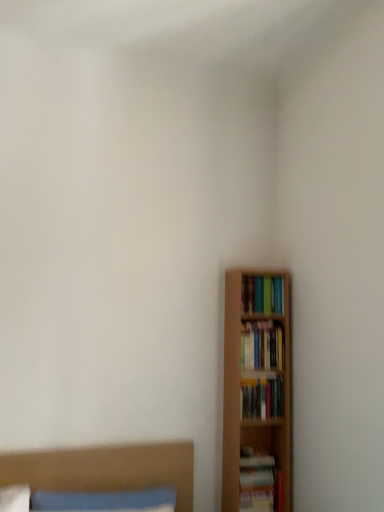
Question: From the image's perspective, relative to hardcover book at lower right, arranged as the first book when ordered from the bottom, is wooden bed at lower left above or below?

Choices:
 (A) above
 (B) below

Answer: (A)

Question: From a real-world perspective, relative to hardcover book at lower right, the 4th book from the top, is wooden bed at lower left vertically above or below?

Choices:
 (A) below
 (B) above

Answer: (B)

Question: Estimate the real-world distances between objects in this image. Which object is closer to the hardcover books at right, which is the 2th book in top-to-bottom order?

Choices:
 (A) hardcover book at lower right, the 4th book from the top
 (B) wooden bed at lower left
 (C) matte green book at right, the fourth book when ordered from bottom to top
 (D) hardcover books at right, acting as the second book starting from the bottom

Answer: (D)

Question: Which of these objects is positioned closest to the matte green book at right, placed as the 1th book when sorted from top to bottom?

Choices:
 (A) hardcover book at lower right, the 4th book from the top
 (B) wooden bed at lower left
 (C) hardcover books at right, placed as the third book when sorted from bottom to top
 (D) hardcover books at right, acting as the second book starting from the bottom

Answer: (C)